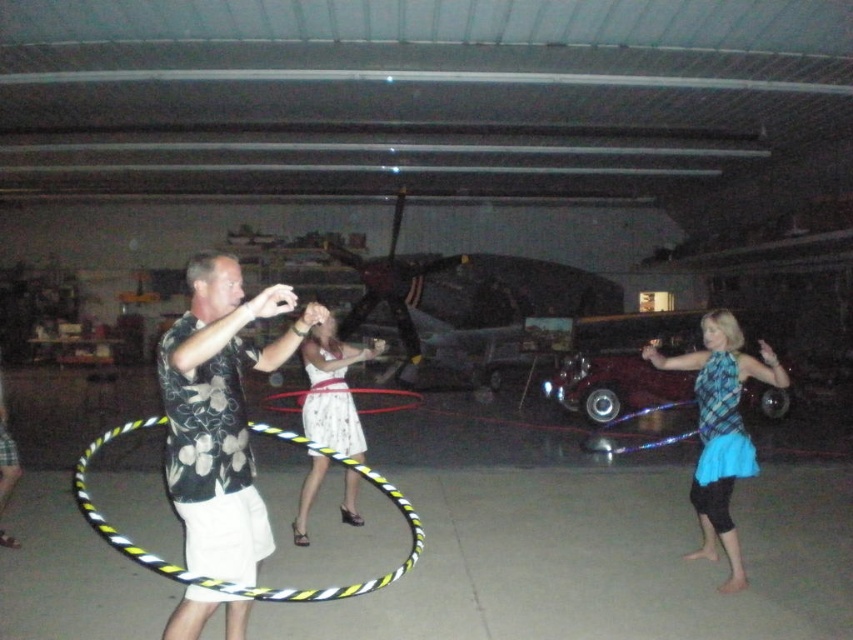
Question: From the image, what is the correct spatial relationship of blue plaid shirt at center in relation to yellow and black striped hula hoop at center?

Choices:
 (A) left
 (B) right

Answer: (B)

Question: Among these points, which one is farthest from the camera?

Choices:
 (A) (318, 372)
 (B) (564, 372)
 (C) (280, 589)

Answer: (B)

Question: Among these objects, which one is farthest from the camera?

Choices:
 (A) white floral dress at center
 (B) blue plaid shirt at center
 (C) black floral shirt at center
 (D) shiny maroon car at center

Answer: (D)

Question: Estimate the real-world distances between objects in this image. Which object is closer to the yellow and black striped hula hoop at center?

Choices:
 (A) blue plaid shirt at center
 (B) shiny maroon car at center

Answer: (A)

Question: Does yellow and black striped hula hoop at center have a lesser width compared to shiny maroon car at center?

Choices:
 (A) yes
 (B) no

Answer: (A)

Question: In this image, where is black floral shirt at center located relative to white floral dress at center?

Choices:
 (A) below
 (B) above

Answer: (B)